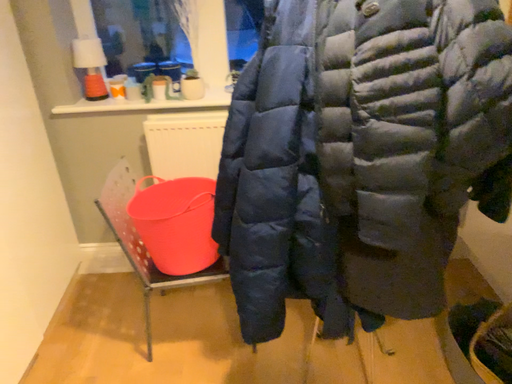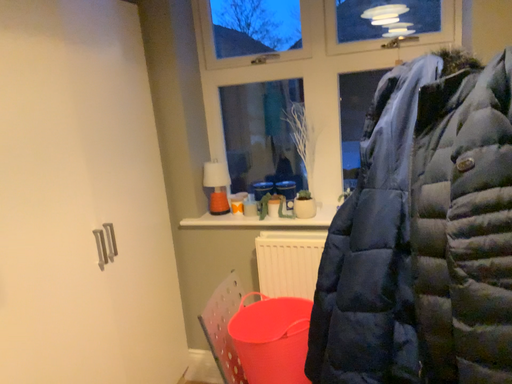
Question: Which way did the camera rotate in the video?

Choices:
 (A) rotated right
 (B) rotated left

Answer: (B)